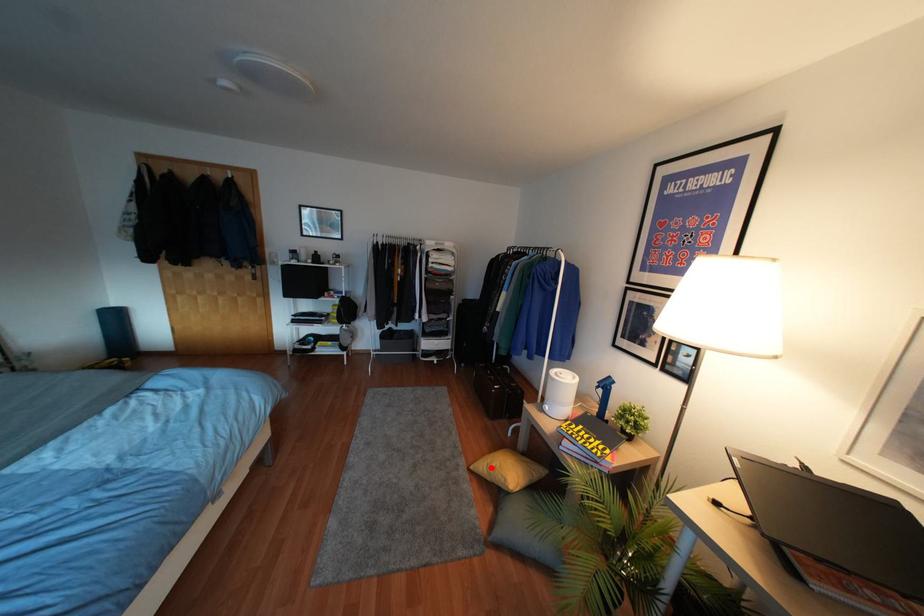
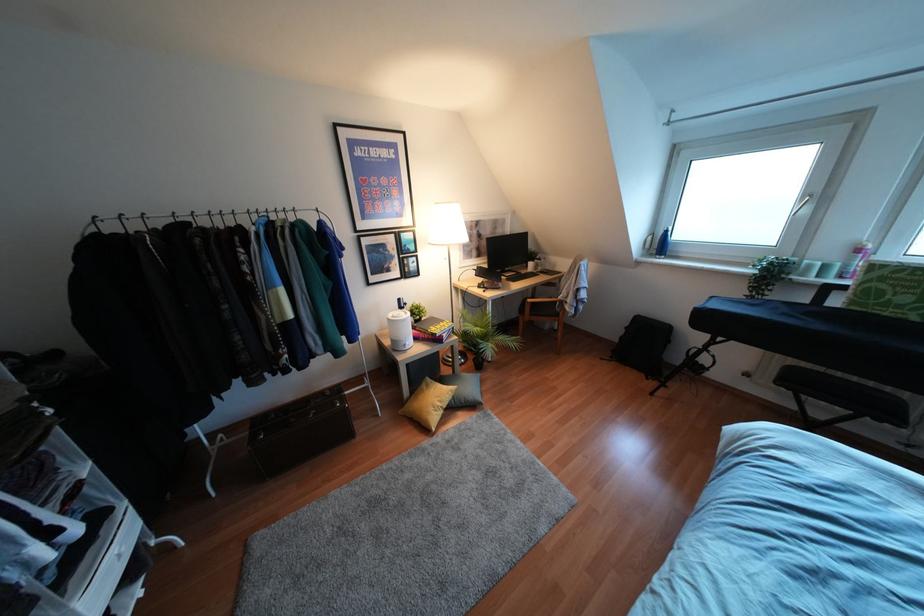
Question: I am providing you with two images of the same scene from different viewpoints. Image1 has a red point marked. In image2, the corresponding 3D location appears at what relative position? Reply with the corresponding letter.

Choices:
 (A) Closer
 (B) Farther

Answer: (B)